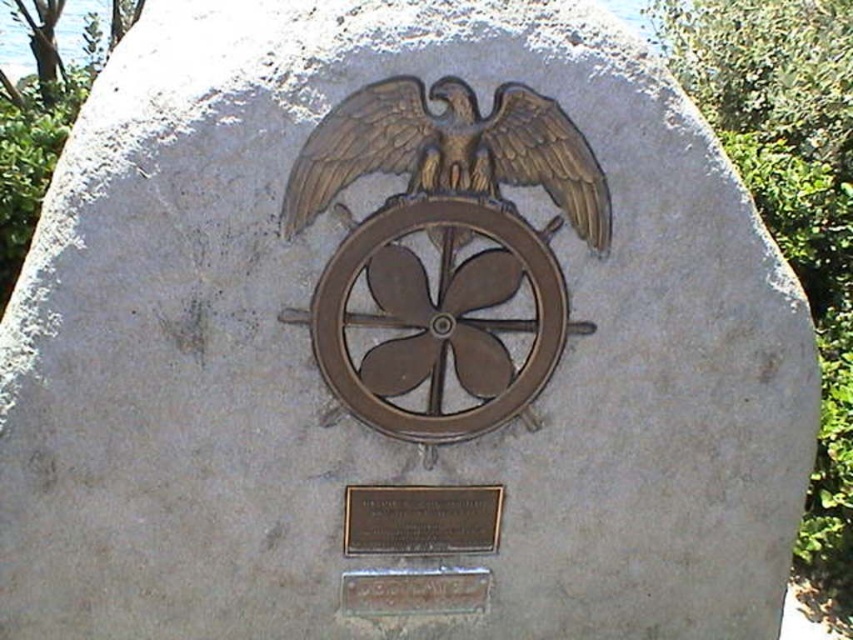
You are standing at the camera position and want to place a small flag exactly at point (582, 184). If your arm can reach up to 1.8 meters, will you be able to reach that point?

The distance between point (582, 184) and the camera is 1.77 meters, so yes, you can reach it with your arm since it is within the 1.8 meters limit.

You are a historian examining the monument. You notice a point marked at coordinates (421, 518). According to the description, where exactly is this point located on the monument?

The point at (421, 518) is on the bronze plaque at lower center.

You are an art conservator assessing the monument. You notice the gold polished metal eagle at center and the bronze plaque at lower center. Which object is taller?

The gold polished metal eagle at center has a greater height compared to the bronze plaque at lower center, so the gold polished metal eagle at center is taller.